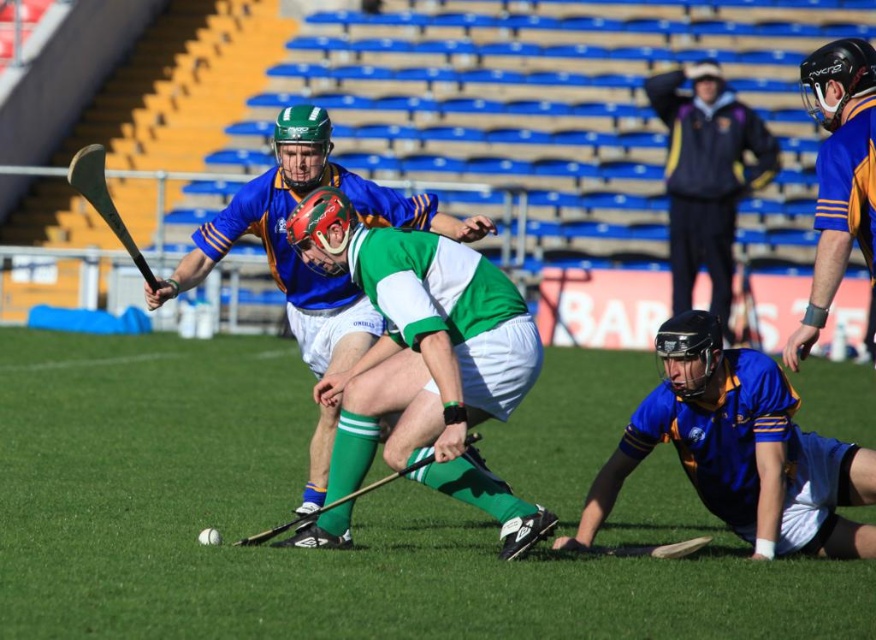
Question: Which point appears farthest from the camera in this image?

Choices:
 (A) (680, 220)
 (B) (291, 291)
 (C) (772, 451)
 (D) (380, 289)

Answer: (A)

Question: Considering the relative positions of green matte jersey at center and blue jersey at lower right in the image provided, where is green matte jersey at center located with respect to blue jersey at lower right?

Choices:
 (A) right
 (B) left

Answer: (B)

Question: Which of the following is the closest to the observer?

Choices:
 (A) (684, 109)
 (B) (371, 243)

Answer: (B)

Question: Estimate the real-world distances between objects in this image. Which object is closer to the dark blue jacket at upper center?

Choices:
 (A) green matte jersey at center
 (B) green matte helmet at center

Answer: (B)

Question: Can you confirm if green matte jersey at center is wider than green matte helmet at center?

Choices:
 (A) no
 (B) yes

Answer: (A)

Question: Is blue jersey at lower right wider than dark blue jacket at upper center?

Choices:
 (A) no
 (B) yes

Answer: (B)